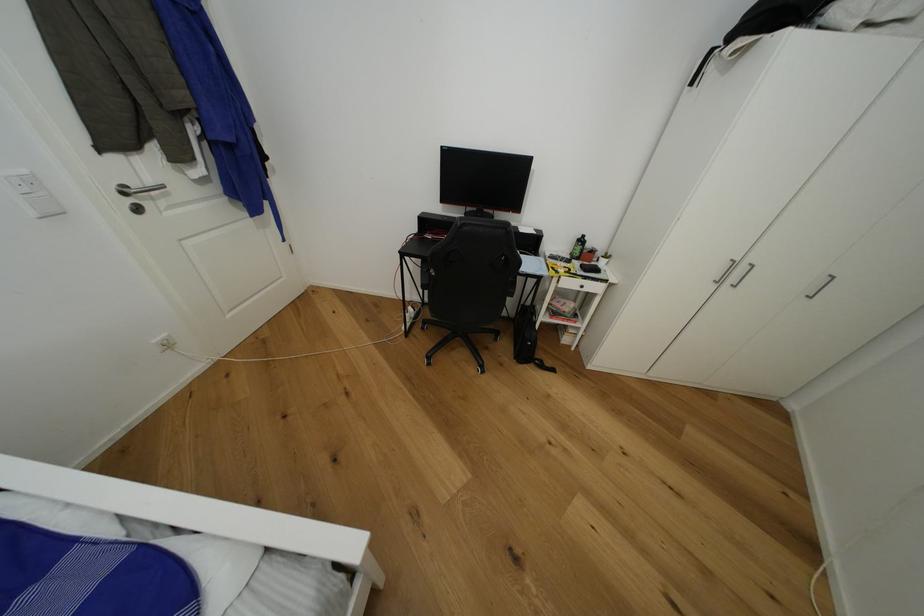
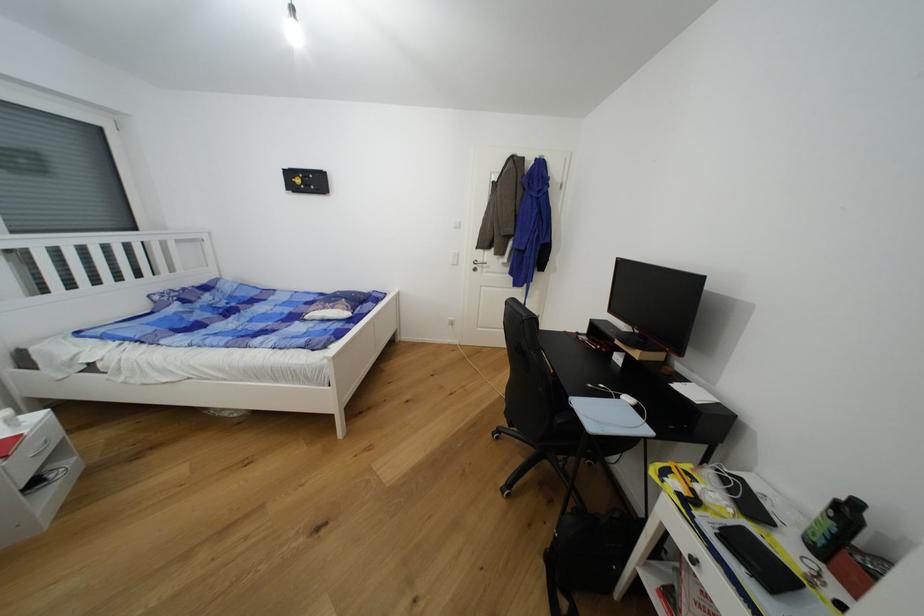
Find the pixel in the second image that matches (x=140, y=185) in the first image.

(484, 262)